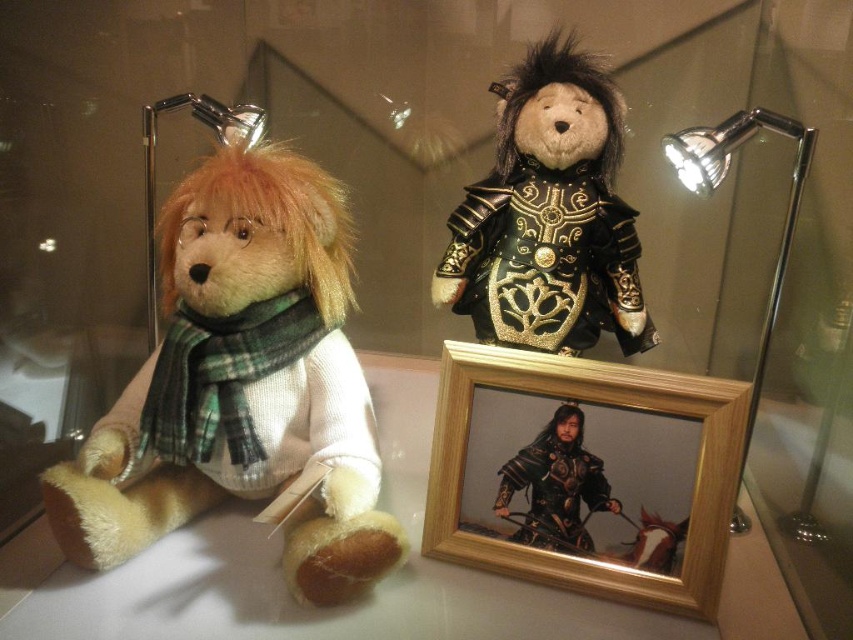
Question: Which of the following is the farthest from the observer?

Choices:
 (A) (137, 387)
 (B) (593, 125)
 (C) (572, 460)
 (D) (439, 422)

Answer: (B)

Question: Can you confirm if fluffy beige teddy bear at left is bigger than metallic armor figure at center?

Choices:
 (A) no
 (B) yes

Answer: (B)

Question: Does velvet-like black armor at upper center have a greater width compared to wooden photo frame at center?

Choices:
 (A) no
 (B) yes

Answer: (A)

Question: Is fluffy beige teddy bear at left to the right of wooden photo frame at center from the viewer's perspective?

Choices:
 (A) yes
 (B) no

Answer: (B)

Question: Which object is the farthest from the fluffy beige teddy bear at left?

Choices:
 (A) metallic armor figure at center
 (B) wooden photo frame at center

Answer: (A)

Question: Which of the following is the farthest from the observer?

Choices:
 (A) (698, 550)
 (B) (228, 221)
 (C) (596, 500)
 (D) (645, 326)

Answer: (D)